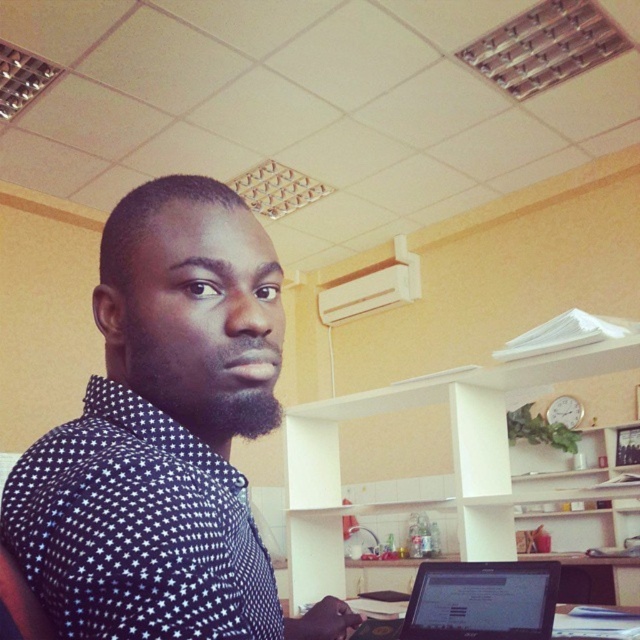
Question: Which object is farther from the camera taking this photo?

Choices:
 (A) black dotted shirt at center
 (B) black matte laptop at lower center
 (C) black dotted shirt at upper left

Answer: (B)

Question: Does black dotted shirt at center appear over black dotted shirt at upper left?

Choices:
 (A) no
 (B) yes

Answer: (B)

Question: Which object appears closest to the camera in this image?

Choices:
 (A) black matte laptop at lower center
 (B) black dotted shirt at upper left
 (C) black dotted shirt at center

Answer: (C)

Question: Is black dotted shirt at upper left above black matte laptop at lower center?

Choices:
 (A) no
 (B) yes

Answer: (B)

Question: Is black dotted shirt at center bigger than black matte laptop at lower center?

Choices:
 (A) yes
 (B) no

Answer: (B)

Question: Among these points, which one is nearest to the camera?

Choices:
 (A) (83, 592)
 (B) (72, 634)
 (C) (449, 579)

Answer: (A)